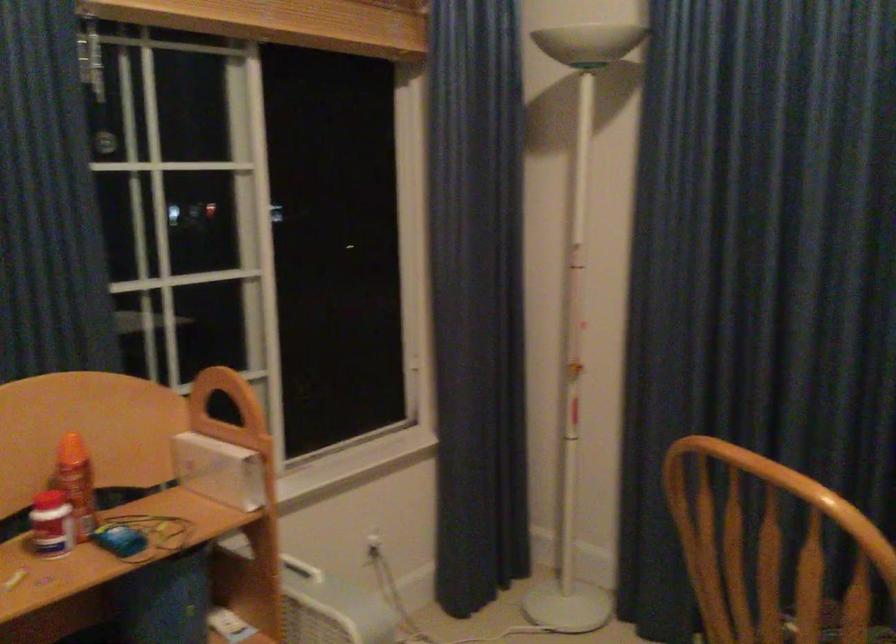
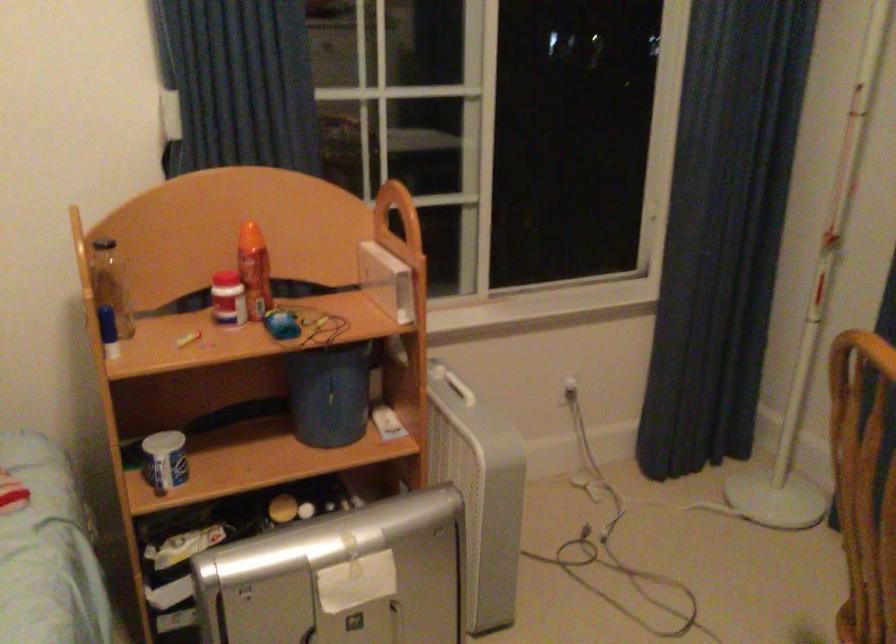
Locate, in the second image, the point that corresponds to point 730,563 in the first image.

(864, 484)